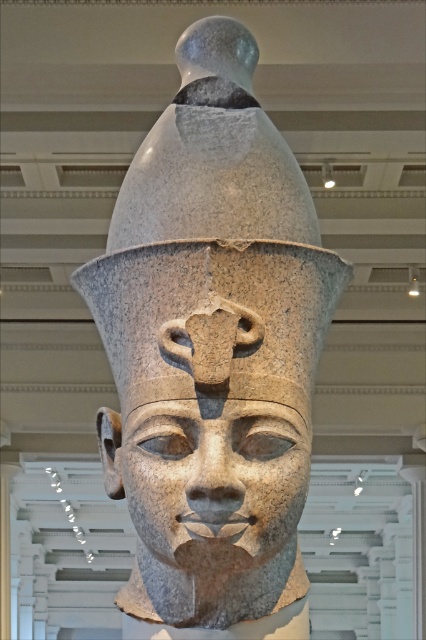
Question: Is granite statue at center positioned behind granite statue at upper center?

Choices:
 (A) no
 (B) yes

Answer: (A)

Question: Can you confirm if granite statue at center is positioned above granite face at center?

Choices:
 (A) yes
 (B) no

Answer: (B)

Question: Does granite statue at center appear on the left side of granite statue at upper center?

Choices:
 (A) yes
 (B) no

Answer: (A)

Question: Which point is closer to the camera?

Choices:
 (A) granite statue at center
 (B) granite face at center
 (C) granite statue at upper center

Answer: (B)

Question: Which object is positioned farthest from the granite statue at upper center?

Choices:
 (A) granite face at center
 (B) granite statue at center

Answer: (A)

Question: Among these points, which one is farthest from the camera?

Choices:
 (A) (161, 371)
 (B) (233, 56)
 (C) (253, 484)

Answer: (B)